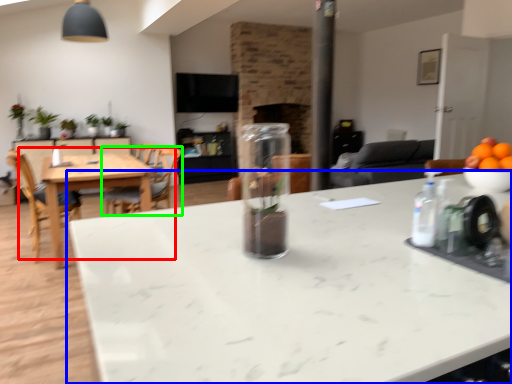
Question: Based on their relative distances, which object is nearer to kitchen & dining room table (highlighted by a red box)? Choose from countertop (highlighted by a blue box) and chair (highlighted by a green box).

Choices:
 (A) countertop
 (B) chair

Answer: (B)